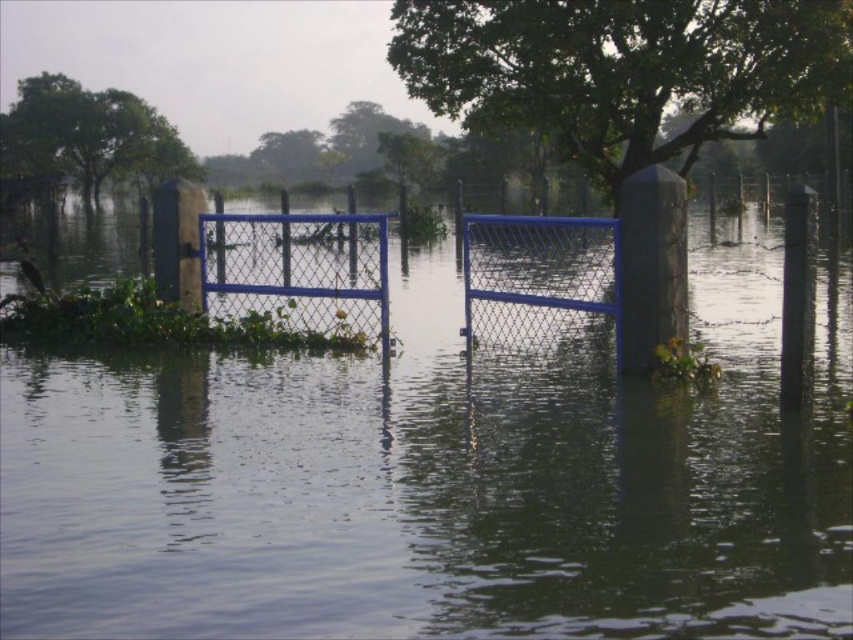
You are a drone operator trying to capture aerial footage of a flooded area. Your drone has a maximum flight range of 70 meters. You see a green leafy tree at upper left in the scene. Can your drone reach it to capture clear footage of the tree?

The green leafy tree at upper left is 69.34 meters away from the camera. Since the drone has a maximum flight range of 70 meters, it can reach the tree and capture clear footage.

You are a photographer trying to capture the blue metallic gate at center and the green leafy tree at upper center in a single frame. Given their sizes, which object will occupy more space in your photo?

The blue metallic gate at center is bigger than the green leafy tree at upper center, so it will occupy more space in the photo.